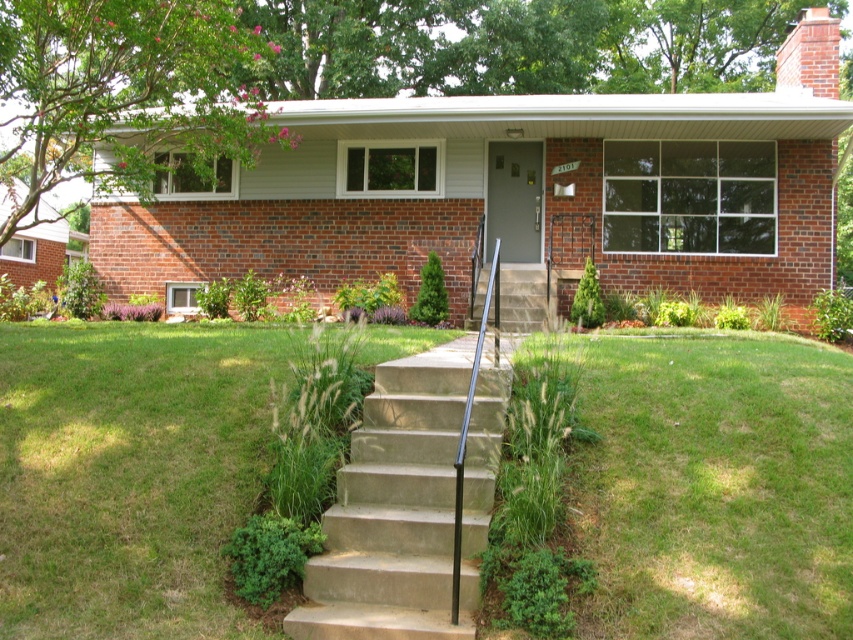
Question: Which of the following is the farthest from the observer?

Choices:
 (A) (662, 348)
 (B) (329, 611)

Answer: (A)

Question: Does green grass at lower center appear on the left side of concrete/steps at center?

Choices:
 (A) yes
 (B) no

Answer: (B)

Question: Among these objects, which one is farthest from the camera?

Choices:
 (A) concrete/steps at center
 (B) green grass at lower center

Answer: (A)

Question: Can you confirm if green grass at lower center is positioned to the right of concrete/steps at center?

Choices:
 (A) no
 (B) yes

Answer: (B)

Question: Does green grass at lower center have a greater width compared to concrete/steps at center?

Choices:
 (A) yes
 (B) no

Answer: (A)